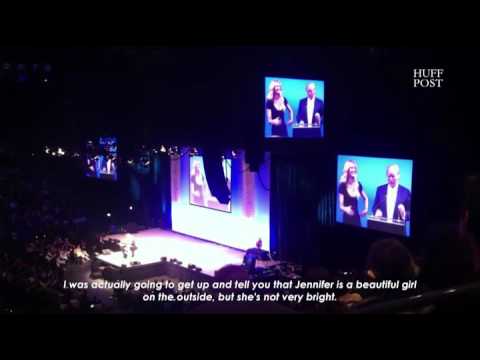
Where is `stage`? Image resolution: width=480 pixels, height=360 pixels. stage is located at coordinates (169, 246).